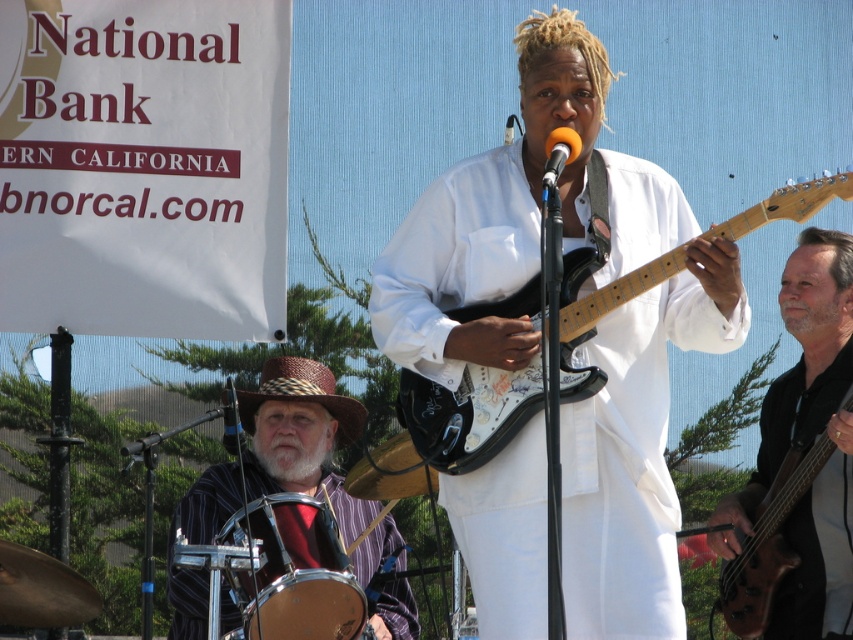
Question: Can you confirm if white matte guitar at center is positioned above orange matte microphone at center?

Choices:
 (A) yes
 (B) no

Answer: (B)

Question: Is white matte guitar at center positioned before white glossy electric guitar at center?

Choices:
 (A) yes
 (B) no

Answer: (B)

Question: Estimate the real-world distances between objects in this image. Which object is closer to the orange matte microphone at center?

Choices:
 (A) white matte guitar at center
 (B) brown wood bass guitar at lower right
 (C) shiny silver drum at lower left
 (D) white glossy electric guitar at center

Answer: (D)

Question: Considering the real-world distances, which object is farthest from the shiny silver drum at lower left?

Choices:
 (A) white matte guitar at center
 (B) brown wood bass guitar at lower right

Answer: (B)

Question: Considering the relative positions of white matte guitar at center and white glossy electric guitar at center in the image provided, where is white matte guitar at center located with respect to white glossy electric guitar at center?

Choices:
 (A) right
 (B) left

Answer: (B)

Question: Which point appears farthest from the camera in this image?

Choices:
 (A) (404, 563)
 (B) (410, 442)
 (C) (619, 172)

Answer: (A)